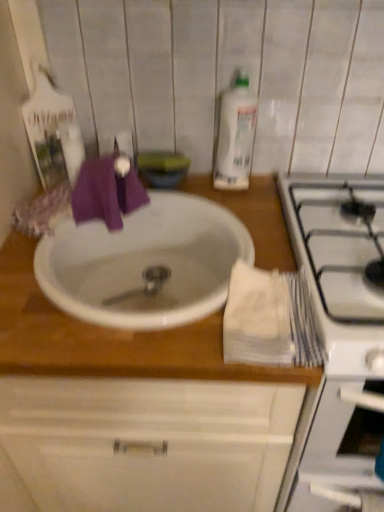
Image resolution: width=384 pixels, height=512 pixels. In order to click on vacant region to the left of clear plastic bottle at upper center in this screenshot , I will do `click(187, 189)`.